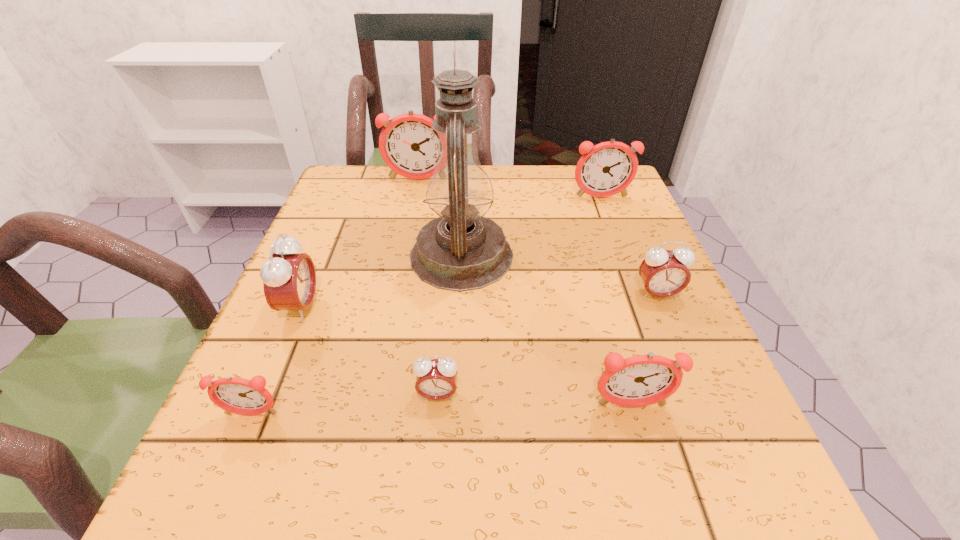
The width and height of the screenshot is (960, 540). I want to click on object positioned at the far right corner, so click(606, 169).

In the image, there is a desktop. Where is `free space at the far edge`? The image size is (960, 540). free space at the far edge is located at coordinates (503, 184).

Locate an element on the screen. This screenshot has height=540, width=960. vacant space at the left edge of the desktop is located at coordinates (317, 222).

Identify the location of vacant space at the right edge of the desktop. (658, 336).

The image size is (960, 540). In the image, there is a desktop. In order to click on vacant area at the far left corner in this screenshot , I will do `click(338, 189)`.

Locate an element on the screen. This screenshot has width=960, height=540. vacant space at the far right corner of the desktop is located at coordinates (596, 200).

This screenshot has height=540, width=960. Identify the location of vacant area between the biggest pink alarm clock and the rightmost pink alarm clock. (479, 301).

Locate an element on the screen. The image size is (960, 540). free spot between the leftmost reddish-pink alarm clock and the second farthest object is located at coordinates (426, 306).

The width and height of the screenshot is (960, 540). What are the coordinates of `empty space that is in between the smallest reddish-pink alarm clock and the second smallest reddish-pink alarm clock` in the screenshot? It's located at (442, 410).

You are a GUI agent. You are given a task and a screenshot of the screen. Output one action in this format:
    pyautogui.click(x=<x>, y=<y>)
    Task: Click on the empty space between the oil lamp and the smallest reddish-pink alarm clock
    This screenshot has width=960, height=540.
    Given the screenshot: What is the action you would take?
    pyautogui.click(x=356, y=335)